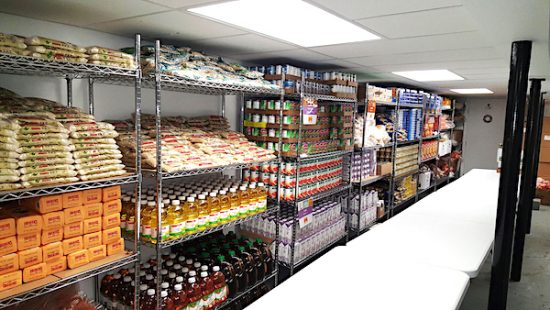
The height and width of the screenshot is (310, 550). In order to click on cardboard boxesshelves in this screenshot , I will do `click(544, 153)`, `click(544, 169)`, `click(126, 180)`, `click(191, 170)`, `click(312, 155)`, `click(366, 149)`, `click(406, 142)`.